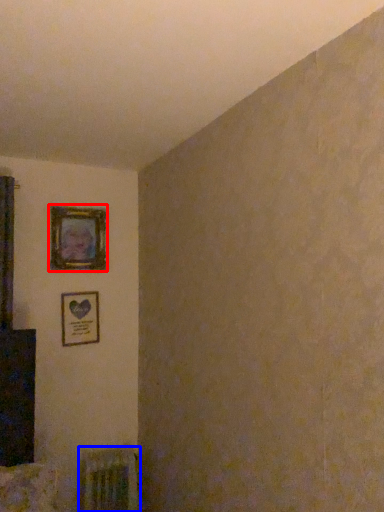
Question: Which object appears farthest to the camera in this image, picture frame (highlighted by a red box) or radiator (highlighted by a blue box)?

Choices:
 (A) picture frame
 (B) radiator

Answer: (A)